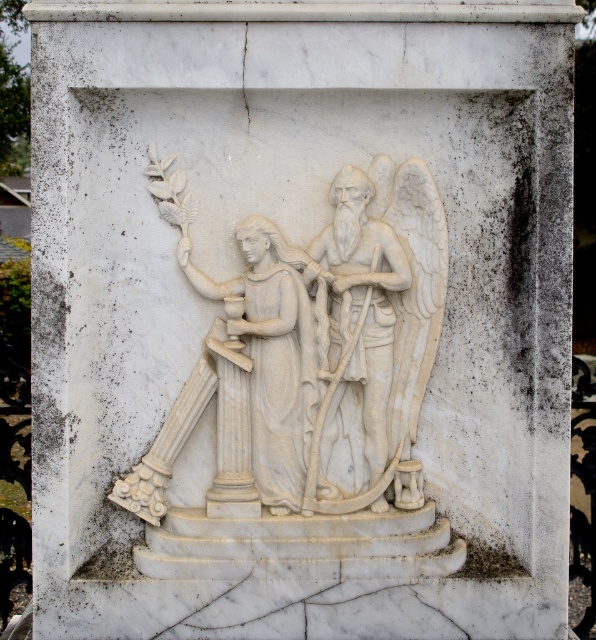
This screenshot has height=640, width=596. What do you see at coordinates (312, 355) in the screenshot?
I see `white marble sculpture at center` at bounding box center [312, 355].

Which is in front, point (240, 321) or point (324, 237)?

Point (240, 321)

Identify the location of white marble sculpture at center. This screenshot has height=640, width=596. [x=312, y=355].

Which is more to the left, white marble angel at center or white marble statue at left?

From the viewer's perspective, white marble statue at left appears more on the left side.

Does white marble angel at center have a lesser width compared to white marble statue at left?

Correct, white marble angel at center's width is less than white marble statue at left's.

Where is `white marble angel at center`? white marble angel at center is located at coordinates (358, 358).

Is white marble sculpture at center below white marble statue at left?

Actually, white marble sculpture at center is above white marble statue at left.

Can you confirm if white marble sculpture at center is thinner than white marble statue at left?

No, white marble sculpture at center is not thinner than white marble statue at left.

The image size is (596, 640). I want to click on white marble sculpture at center, so click(x=312, y=355).

Where is `white marble sculpture at center`? The width and height of the screenshot is (596, 640). white marble sculpture at center is located at coordinates (312, 355).